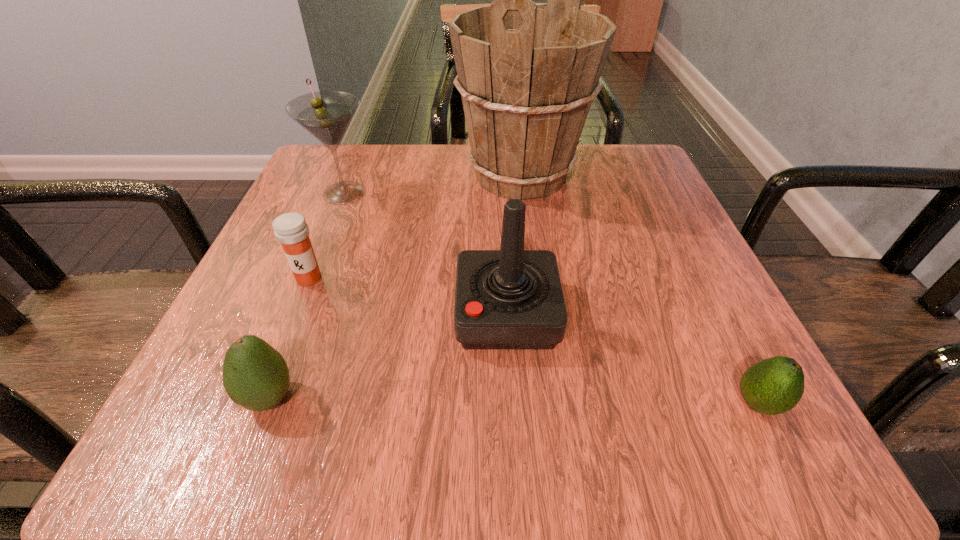
This screenshot has height=540, width=960. I want to click on bucket that is at the right edge, so click(527, 73).

Where is `avocado present at the right edge`? The height and width of the screenshot is (540, 960). avocado present at the right edge is located at coordinates (775, 385).

Find the location of a particular element. object located in the far left corner section of the desktop is located at coordinates (326, 115).

Locate an element on the screen. object that is at the near left corner is located at coordinates (255, 376).

Find the location of a particular element. object located at the far right corner is located at coordinates (527, 73).

You are a GUI agent. You are given a task and a screenshot of the screen. Output one action in this format:
    pyautogui.click(x=<x>, y=<y>)
    Task: Click on the object that is positioned at the near right corner
    This screenshot has height=540, width=960.
    Given the screenshot: What is the action you would take?
    pyautogui.click(x=775, y=385)

The height and width of the screenshot is (540, 960). In the image, there is a desktop. Identify the location of free space at the far edge. (394, 202).

The width and height of the screenshot is (960, 540). In the image, there is a desktop. In order to click on free space at the near edge in this screenshot , I will do `click(588, 407)`.

In order to click on vacant area at the left edge in this screenshot , I will do `click(251, 301)`.

Where is `vacant space at the right edge`? This screenshot has width=960, height=540. vacant space at the right edge is located at coordinates (624, 225).